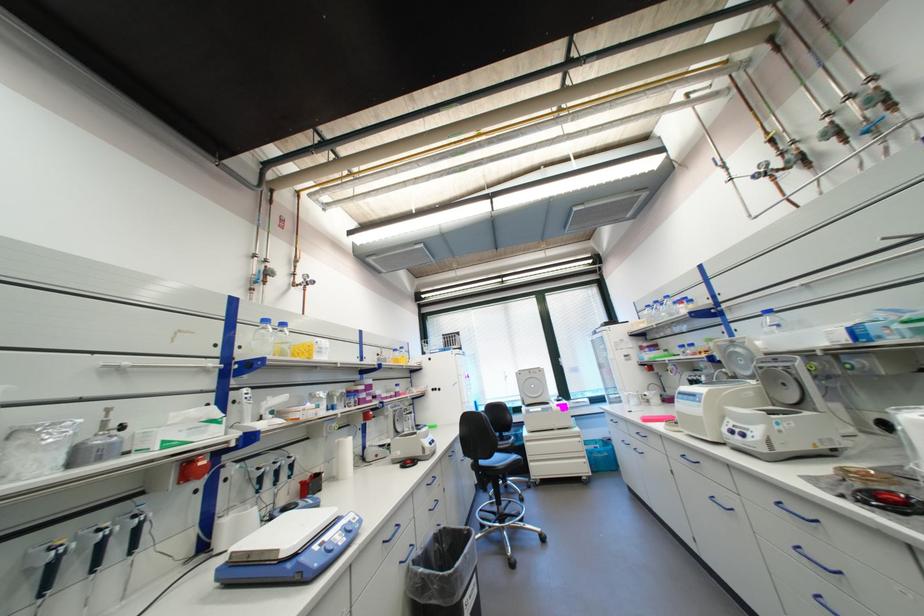
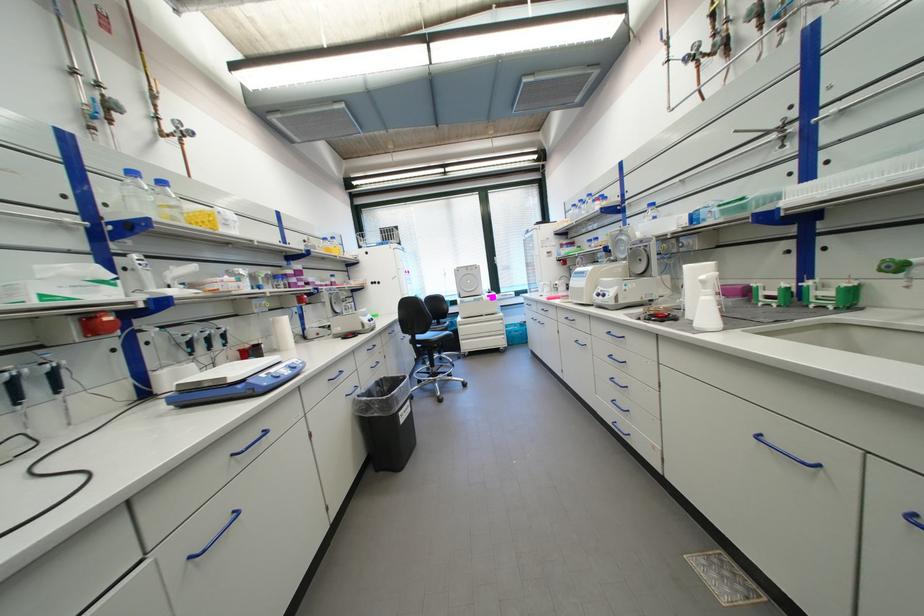
Locate, in the second image, the point that corresponds to pixel 283 323 in the first image.

(156, 180)